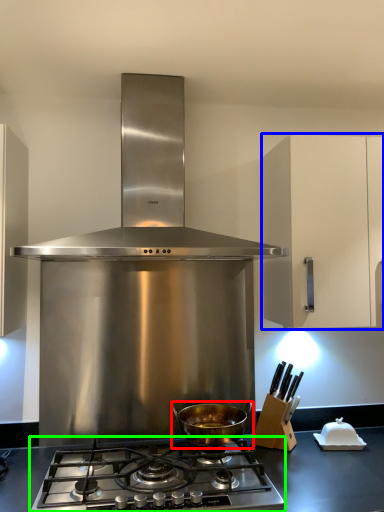
Question: Which is farther away from kitchen appliance (highlighted by a red box)? cabinetry (highlighted by a blue box) or gas stove (highlighted by a green box)?

Choices:
 (A) cabinetry
 (B) gas stove

Answer: (A)